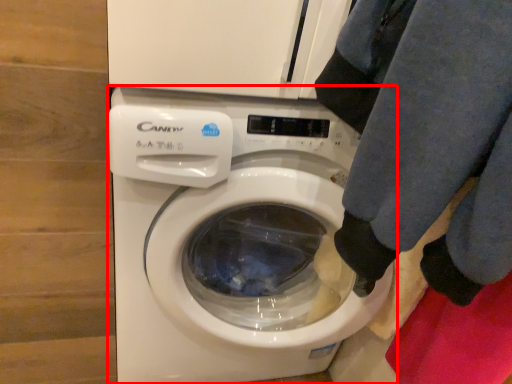
Question: Considering the relative positions of washing machine (annotated by the red box) and clothing in the image provided, where is washing machine (annotated by the red box) located with respect to the staircase?

Choices:
 (A) right
 (B) left

Answer: (B)